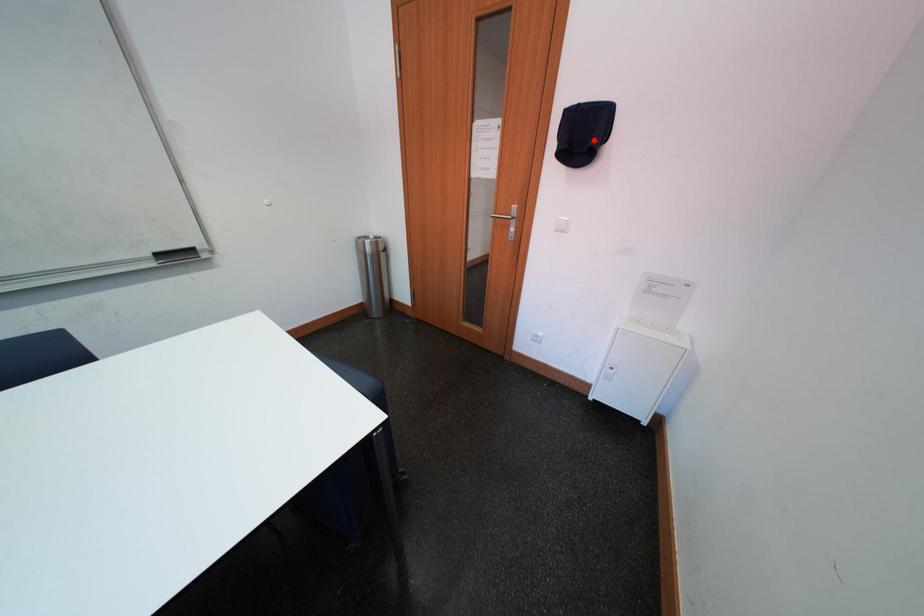
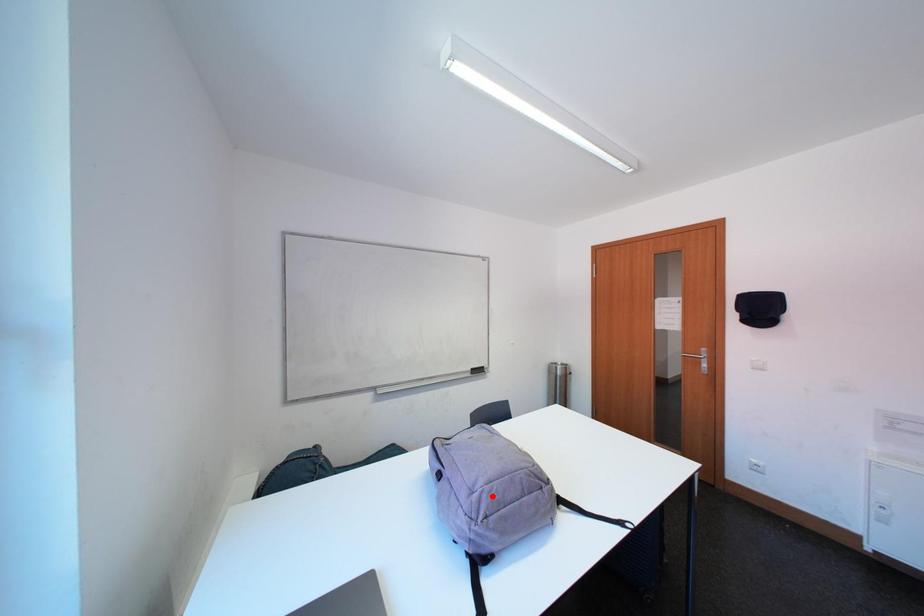
I am providing you with two images of the same scene from different viewpoints. A red point is marked on the first image and another point is marked on the second image. Are the points marked in image1 and image2 representing the same 3D position?

No